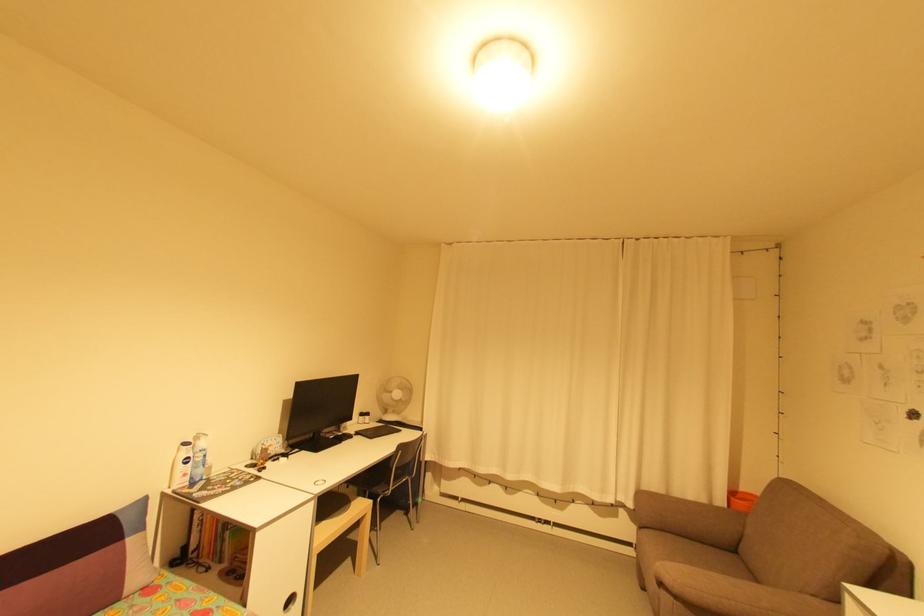
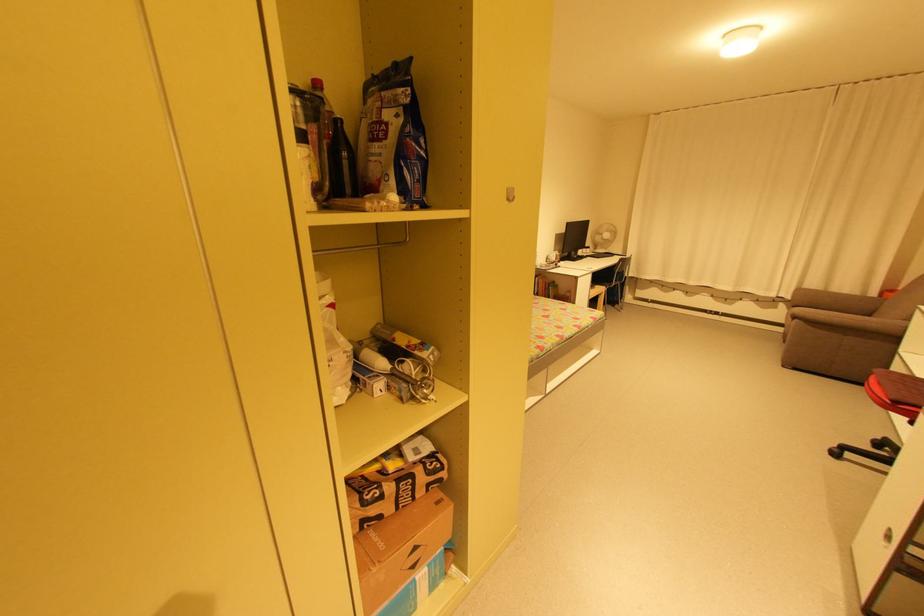
Locate, in the second image, the point that corresponds to point 371,418 in the first image.

(592, 249)